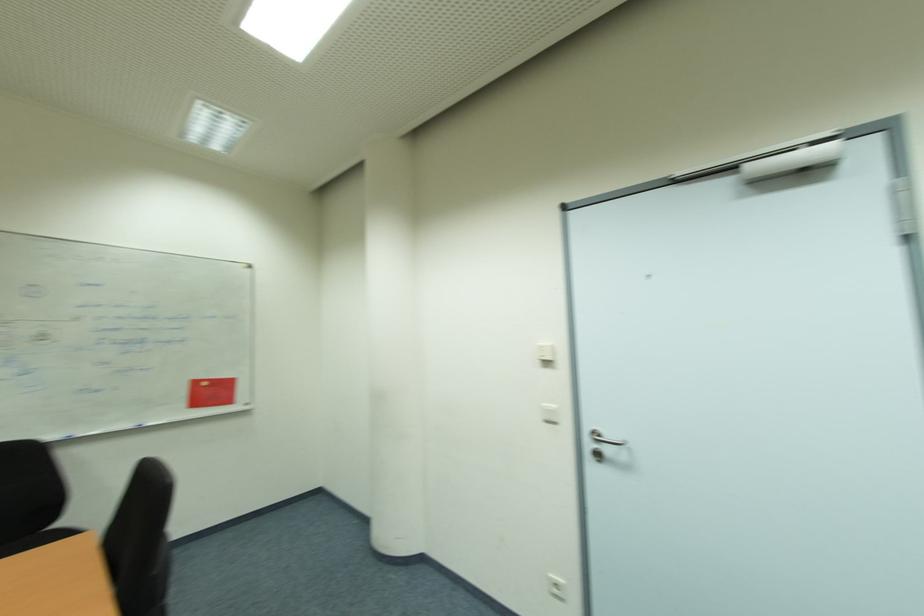
What do you see at coordinates (556, 586) in the screenshot?
I see `a white power outlet` at bounding box center [556, 586].